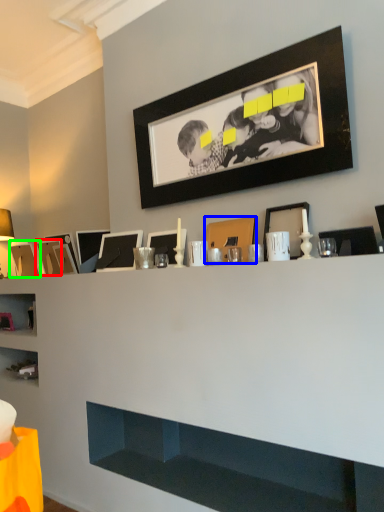
Question: Which object is positioned closest to picture frame (highlighted by a red box)? Select from picture frame (highlighted by a blue box) and picture frame (highlighted by a green box).

Choices:
 (A) picture frame
 (B) picture frame

Answer: (B)